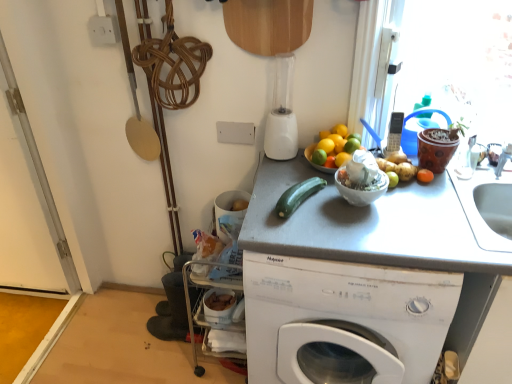
Find the location of `vacant space in between white glossy bowl at center and green smooth-textured zucchini at center`. vacant space in between white glossy bowl at center and green smooth-textured zucchini at center is located at coordinates (336, 214).